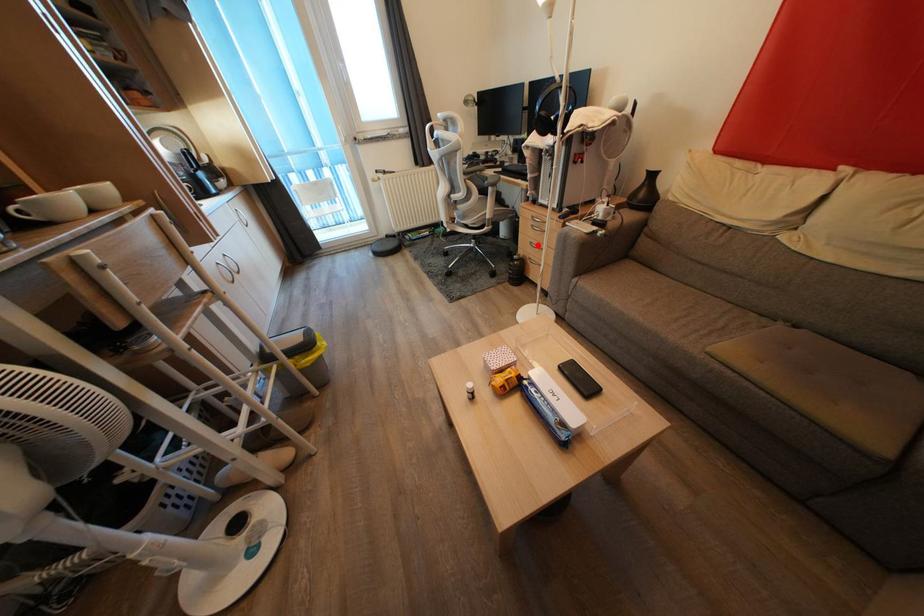
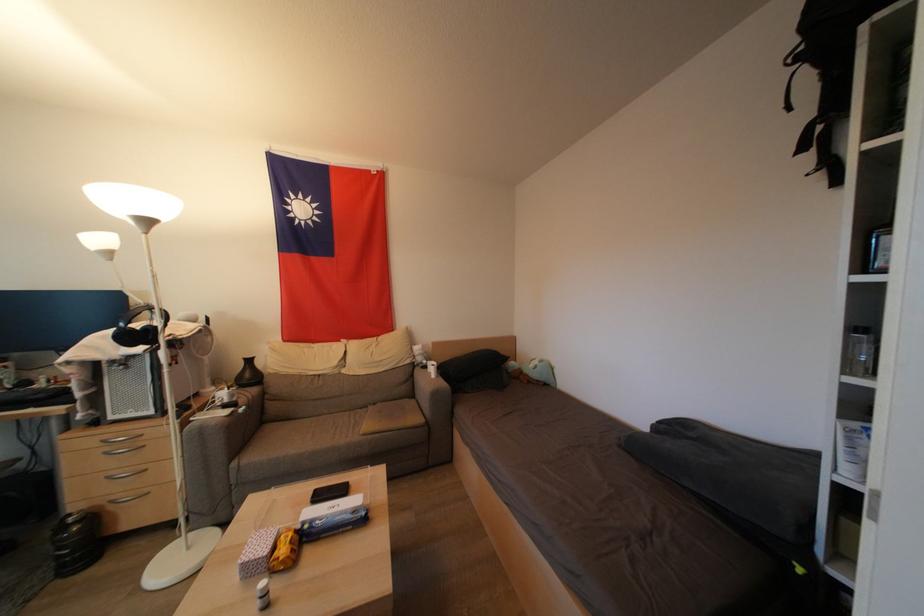
Find the pixel in the second image that matches the highlighted location in the first image.

(117, 477)